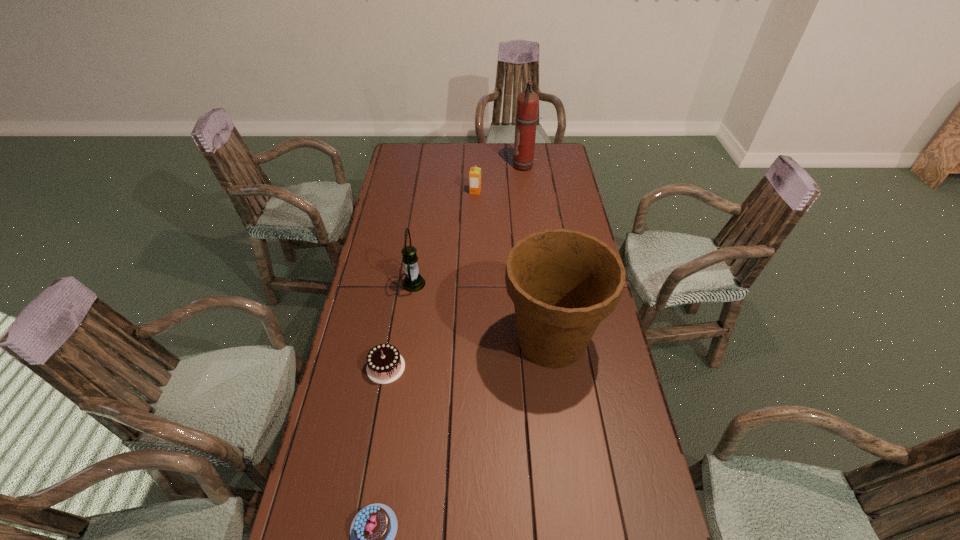
Image resolution: width=960 pixels, height=540 pixels. I want to click on vacant space located on the side of the farthest object with the label and nozzle, so click(463, 166).

The image size is (960, 540). I want to click on vacant region located on the side of the farthest object with the label and nozzle, so click(444, 166).

Where is `vacant space located 0.170m on the front of the second tallest object`? The height and width of the screenshot is (540, 960). vacant space located 0.170m on the front of the second tallest object is located at coordinates (565, 440).

Find the location of `vacant space located on the side where the third farthest object emits light`. vacant space located on the side where the third farthest object emits light is located at coordinates (444, 284).

At what (x,y) coordinates should I click in order to perform the action: click on vacant space situated 0.350m on the right of the fourth object from left to right. Please return your answer as a coordinate pair (x, y). The width and height of the screenshot is (960, 540). Looking at the image, I should click on (559, 192).

This screenshot has height=540, width=960. What are the coordinates of `vacant region located 0.350m on the front of the taller chocolate cake` in the screenshot? It's located at (361, 512).

The width and height of the screenshot is (960, 540). I want to click on object present at the far edge, so click(527, 101).

Locate an element on the screen. lantern at the left edge is located at coordinates (413, 281).

In order to click on chocolate cake located in the left edge section of the desktop in this screenshot , I will do `click(385, 364)`.

Where is `fire extinguisher present at the right edge`? This screenshot has width=960, height=540. fire extinguisher present at the right edge is located at coordinates (527, 101).